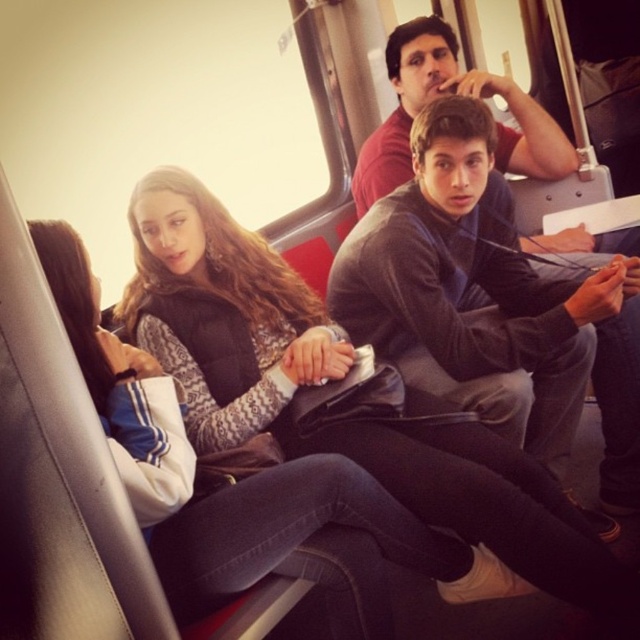
Question: From the image, what is the correct spatial relationship of suede black jacket at center in relation to dark gray sweater at center?

Choices:
 (A) below
 (B) above

Answer: (A)

Question: Among these objects, which one is nearest to the camera?

Choices:
 (A) suede black jacket at center
 (B) dark gray sweater at center

Answer: (A)

Question: Is suede black jacket at center thinner than dark gray sweater at center?

Choices:
 (A) yes
 (B) no

Answer: (B)

Question: Does suede black jacket at center have a lesser width compared to dark gray sweater at center?

Choices:
 (A) yes
 (B) no

Answer: (B)